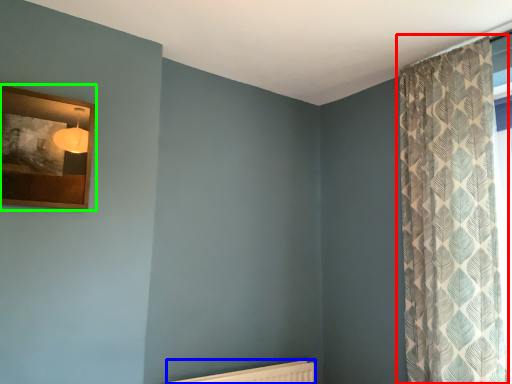
Question: Based on their relative distances, which object is farther from curtain (highlighted by a red box)? Choose from radiator (highlighted by a blue box) and picture frame (highlighted by a green box).

Choices:
 (A) radiator
 (B) picture frame

Answer: (B)